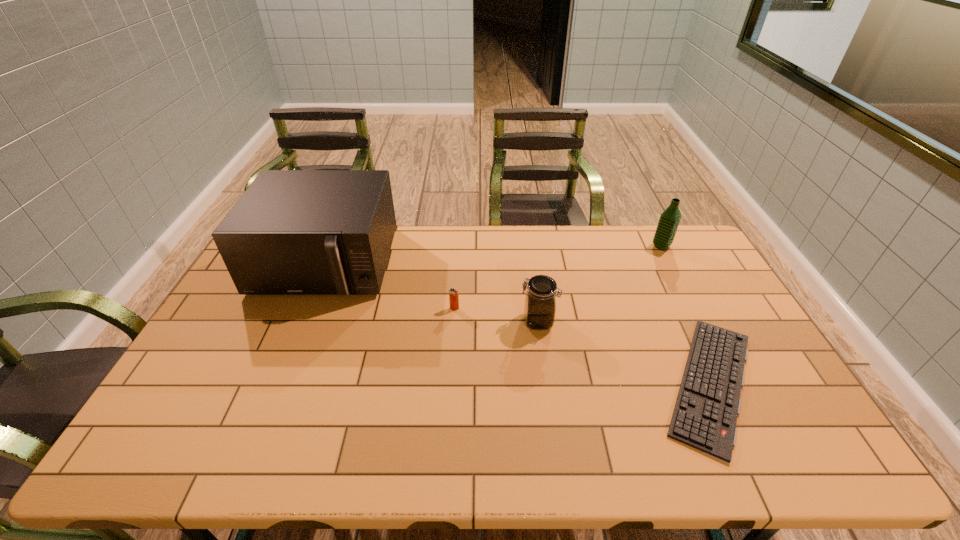
Locate an element on the screen. This screenshot has height=540, width=960. computer keyboard that is at the right edge is located at coordinates (705, 414).

The width and height of the screenshot is (960, 540). Identify the location of object situated at the far left corner. (292, 232).

Find the location of a particular element. object situated at the far right corner is located at coordinates pyautogui.click(x=669, y=220).

You are a GUI agent. You are given a task and a screenshot of the screen. Output one action in this format:
    pyautogui.click(x=<x>, y=<y>)
    Task: Click on the object that is at the near right corner
    Image resolution: width=960 pixels, height=540 pixels.
    Given the screenshot: What is the action you would take?
    pyautogui.click(x=705, y=414)

Locate an element on the screen. free space at the far edge is located at coordinates (587, 238).

Locate an element on the screen. This screenshot has height=540, width=960. vacant region at the near edge is located at coordinates (354, 440).

This screenshot has width=960, height=540. I want to click on free space at the left edge of the desktop, so click(149, 430).

The height and width of the screenshot is (540, 960). Identify the location of vacant space at the right edge of the desktop. [703, 307].

In the image, there is a desktop. Where is `vacant region at the far right corner`? This screenshot has width=960, height=540. vacant region at the far right corner is located at coordinates (670, 255).

Identify the location of free point between the igniter and the microwave oven. This screenshot has width=960, height=540. (390, 286).